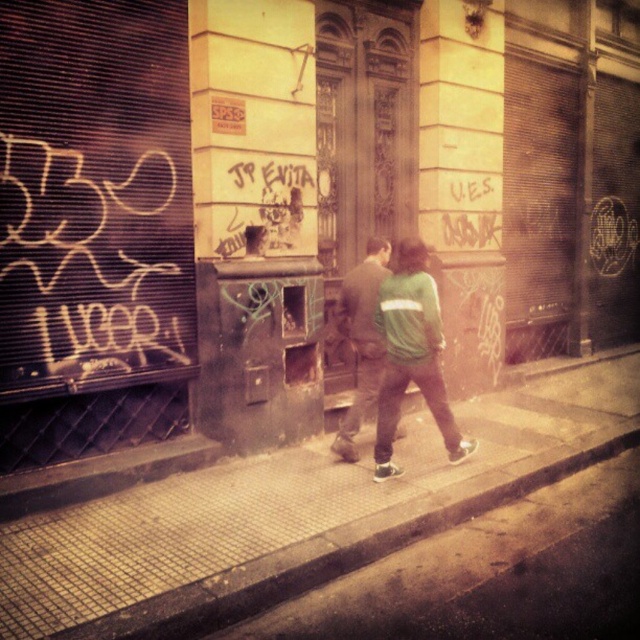
Describe the element at coordinates (292, 509) in the screenshot. I see `smooth concrete sidewalk at center` at that location.

Who is higher up, smooth concrete sidewalk at center or green fabric jacket at center?

green fabric jacket at center is above.

Is point (172, 496) positioned in front of point (333, 442)?

Yes.

Image resolution: width=640 pixels, height=640 pixels. What are the coordinates of `smooth concrete sidewalk at center` in the screenshot? It's located at (292, 509).